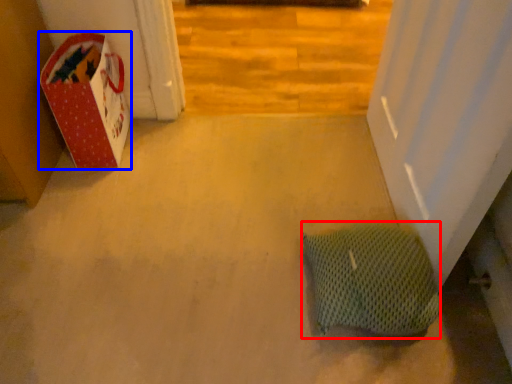
Question: Which object appears farthest to the camera in this image, pillow (highlighted by a red box) or cardboard box (highlighted by a blue box)?

Choices:
 (A) pillow
 (B) cardboard box

Answer: (B)